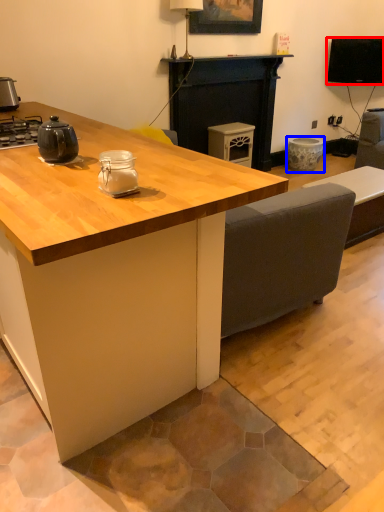
Question: Which point is closer to the camera, television (highlighted by a red box) or appliance (highlighted by a blue box)?

Choices:
 (A) television
 (B) appliance

Answer: (A)